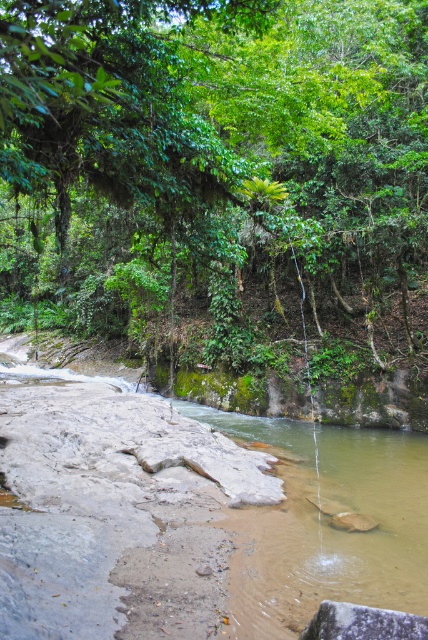
Is green leafy forest at upper center above brown rocky river at center?

Yes.

You are a GUI agent. You are given a task and a screenshot of the screen. Output one action in this format:
    pyautogui.click(x=<x>, y=<y>)
    Task: Click on the green leafy forest at upper center
    This screenshot has height=640, width=428.
    Given the screenshot: What is the action you would take?
    pyautogui.click(x=217, y=170)